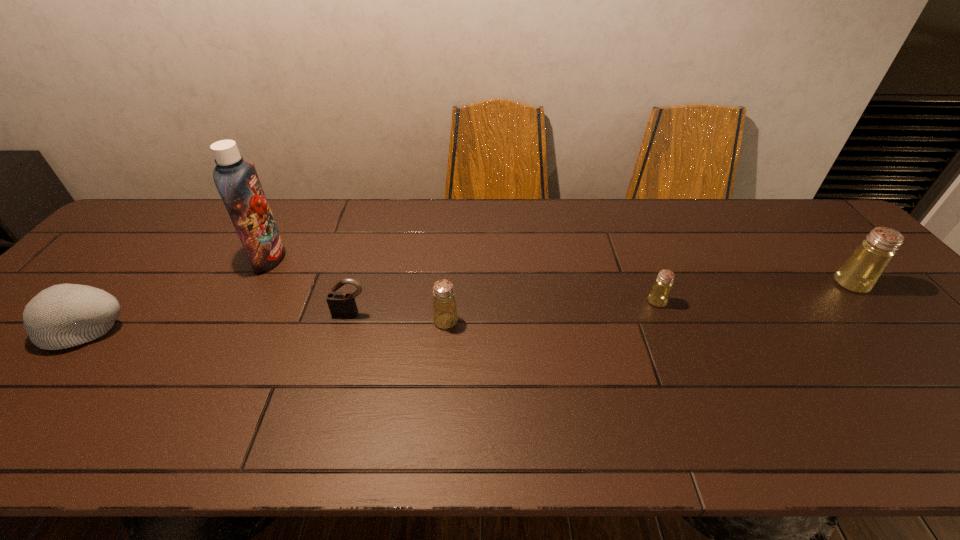
The image size is (960, 540). Identify the location of unoccupied area between the second saltshaker from left to right and the nearest saltshaker. (551, 311).

I want to click on vacant point located between the tallest object and the fifth shortest object, so click(561, 271).

What are the coordinates of `empty location between the fifth shortest object and the leftmost saltshaker` in the screenshot? It's located at (648, 302).

Identify the location of the fourth closest object to the tallest saltshaker. Image resolution: width=960 pixels, height=540 pixels. (237, 182).

Identify which object is the closest to the beanie. Please provide its 2D coordinates. Your answer should be formatted as a tuple, i.e. [(x, y)], where the tuple contains the x and y coordinates of a point satisfying the conditions above.

[(237, 182)]

Choose which saltshaker is the nearest neighbor to the leftmost object. Please provide its 2D coordinates. Your answer should be formatted as a tuple, i.e. [(x, y)], where the tuple contains the x and y coordinates of a point satisfying the conditions above.

[(445, 315)]

Choose which saltshaker is the third nearest neighbor to the tallest object. Please provide its 2D coordinates. Your answer should be formatted as a tuple, i.e. [(x, y)], where the tuple contains the x and y coordinates of a point satisfying the conditions above.

[(860, 272)]

Locate an element on the screen. This screenshot has height=540, width=960. blank space that satisfies the following two spatial constraints: 1. on the front label of the tallest object; 2. on the left side of the rightmost saltshaker is located at coordinates (255, 284).

Where is `vacant space that satisfies the following two spatial constraints: 1. on the front label of the fifth shortest object; 2. on the left side of the shampoo`? vacant space that satisfies the following two spatial constraints: 1. on the front label of the fifth shortest object; 2. on the left side of the shampoo is located at coordinates (255, 284).

The height and width of the screenshot is (540, 960). In order to click on free location that satisfies the following two spatial constraints: 1. on the back side of the third object from right to left; 2. on the left side of the rightmost object in this screenshot , I will do `click(448, 284)`.